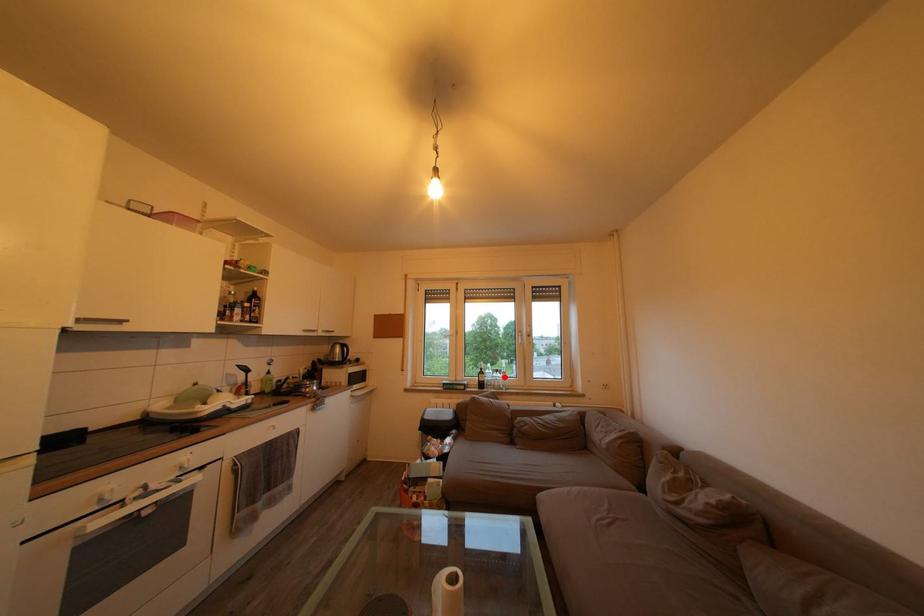
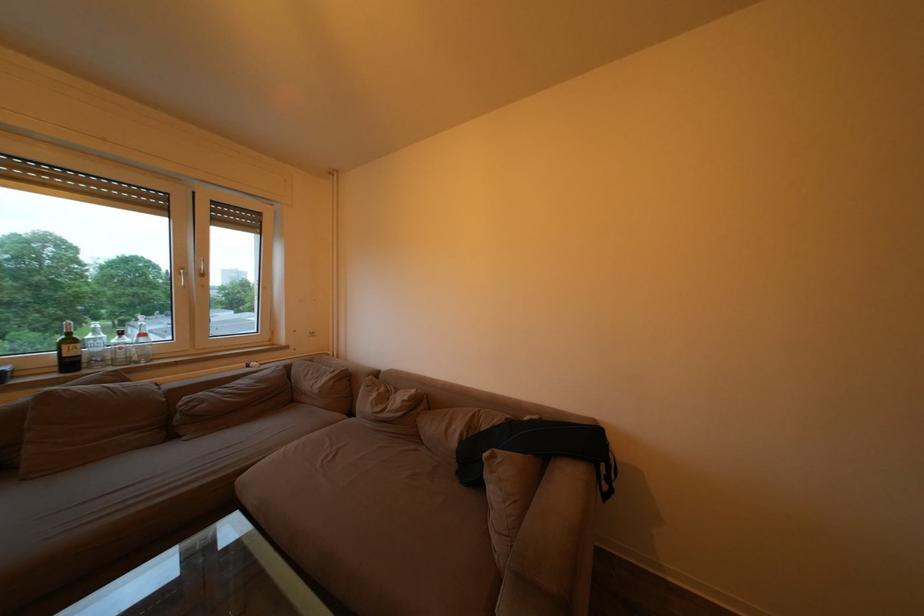
In the second image, find the point that corresponds to the highlighted location in the first image.

(129, 339)